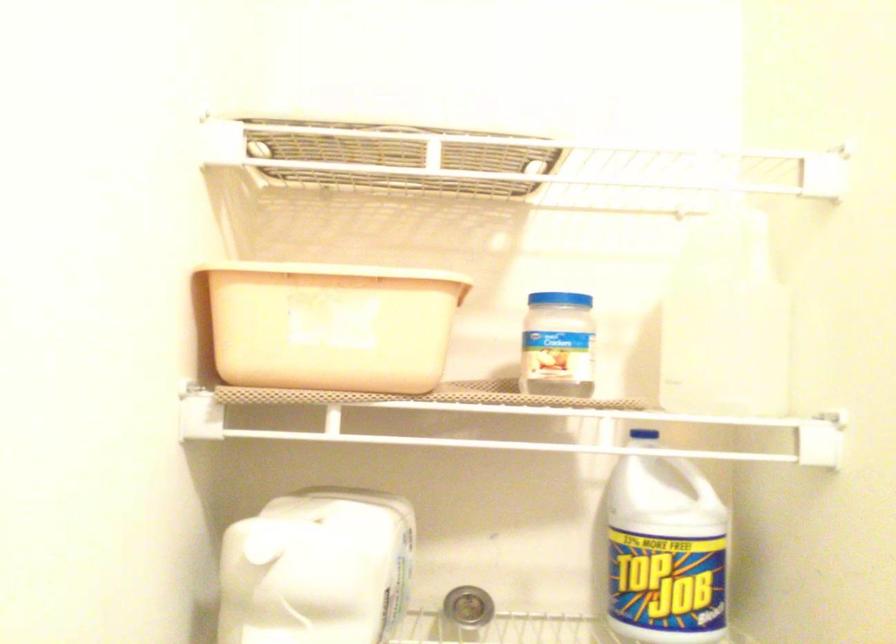
Identify the location of white jug handle. Image resolution: width=896 pixels, height=644 pixels. (309, 506).